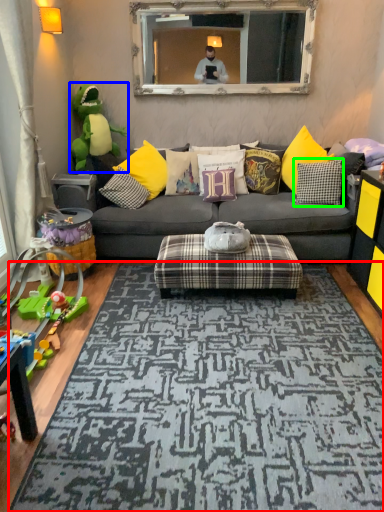
Question: Which object is the farthest from mat (highlighted by a red box)? Choose among these: toy (highlighted by a blue box) or pillow (highlighted by a green box).

Choices:
 (A) toy
 (B) pillow

Answer: (A)